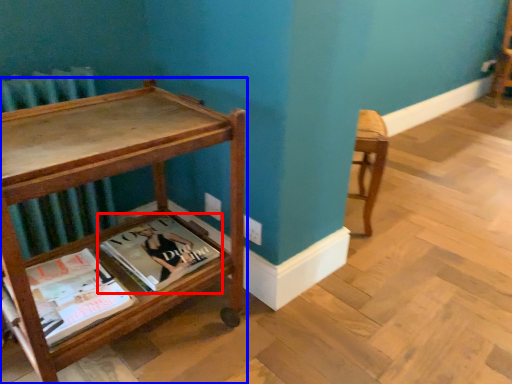
Question: Among these objects, which one is farthest to the camera, book (highlighted by a red box) or table (highlighted by a blue box)?

Choices:
 (A) book
 (B) table

Answer: (A)